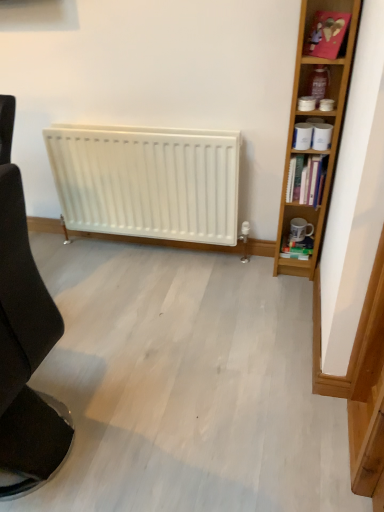
Question: Should I look upward or downward to see pink cardboard at upper right?

Choices:
 (A) down
 (B) up

Answer: (B)

Question: Can you confirm if light brown wood bookcase at right is positioned to the left of pink cardboard at upper right?

Choices:
 (A) yes
 (B) no

Answer: (B)

Question: Does light brown wood bookcase at right have a lesser height compared to pink cardboard at upper right?

Choices:
 (A) no
 (B) yes

Answer: (A)

Question: Can pink cardboard at upper right be found inside light brown wood bookcase at right?

Choices:
 (A) no
 (B) yes

Answer: (B)

Question: Does light brown wood bookcase at right have a greater width compared to pink cardboard at upper right?

Choices:
 (A) yes
 (B) no

Answer: (A)

Question: Is light brown wood bookcase at right positioned before pink cardboard at upper right?

Choices:
 (A) no
 (B) yes

Answer: (B)

Question: From a real-world perspective, is light brown wood bookcase at right on top of pink cardboard at upper right?

Choices:
 (A) yes
 (B) no

Answer: (B)

Question: From a real-world perspective, is black fabric chair at left positioned over white glossy mug at right based on gravity?

Choices:
 (A) yes
 (B) no

Answer: (A)

Question: Considering the relative sizes of black fabric chair at left and white glossy mug at right in the image provided, is black fabric chair at left wider than white glossy mug at right?

Choices:
 (A) no
 (B) yes

Answer: (B)

Question: Does black fabric chair at left turn towards white glossy mug at right?

Choices:
 (A) no
 (B) yes

Answer: (A)

Question: Is black fabric chair at left looking in the opposite direction of white glossy mug at right?

Choices:
 (A) no
 (B) yes

Answer: (A)

Question: Is black fabric chair at left further to camera compared to white glossy mug at right?

Choices:
 (A) yes
 (B) no

Answer: (B)

Question: Can you confirm if black fabric chair at left is smaller than white glossy mug at right?

Choices:
 (A) no
 (B) yes

Answer: (A)

Question: Is black fabric chair at left at the right side of light brown wood bookcase at right?

Choices:
 (A) yes
 (B) no

Answer: (B)